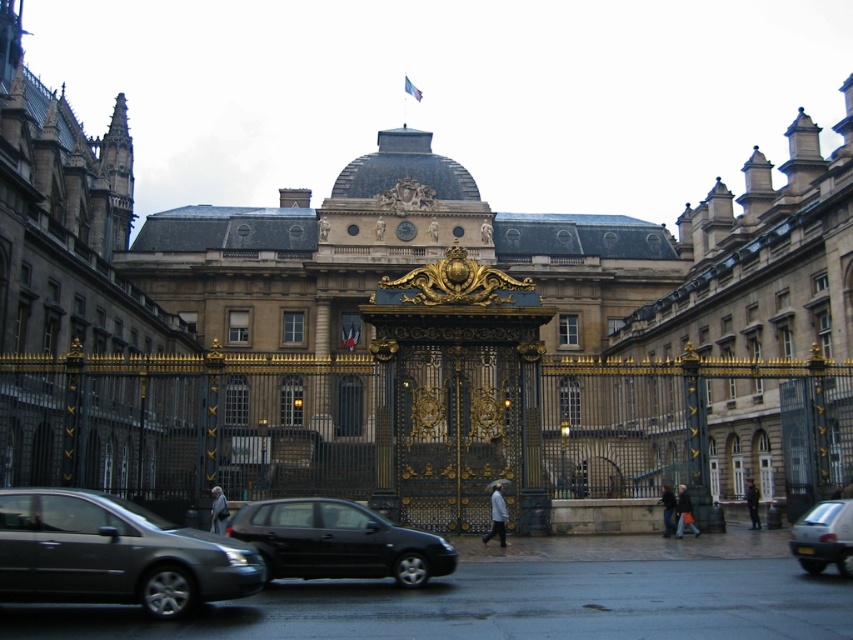
Question: Can you confirm if metallic gray sedan at lower left is bigger than white glossy car at lower right?

Choices:
 (A) no
 (B) yes

Answer: (B)

Question: Can you confirm if metallic gray sedan at lower left is positioned to the right of black metallic car at lower center?

Choices:
 (A) yes
 (B) no

Answer: (B)

Question: Is metallic gray sedan at lower left bigger than black metallic car at lower center?

Choices:
 (A) yes
 (B) no

Answer: (B)

Question: Based on their relative distances, which object is farther from the metallic gray sedan at lower left?

Choices:
 (A) white glossy car at lower right
 (B) black metallic car at lower center

Answer: (A)

Question: Among these points, which one is farthest from the camera?

Choices:
 (A) (825, 531)
 (B) (349, 545)
 (C) (252, 561)

Answer: (A)

Question: Which object is the closest to the black metallic car at lower center?

Choices:
 (A) white glossy car at lower right
 (B) metallic gray sedan at lower left

Answer: (B)